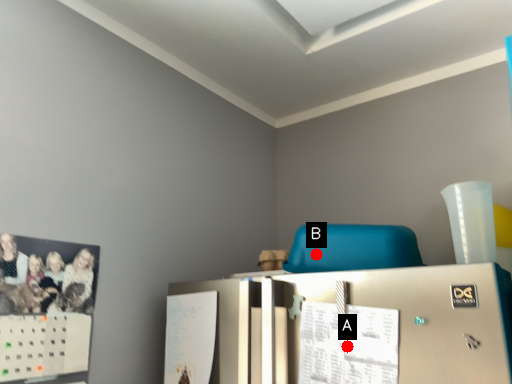
Question: Two points are circled on the image, labeled by A and B beside each circle. Which point is closer to the camera?

Choices:
 (A) A is closer
 (B) B is closer

Answer: (A)